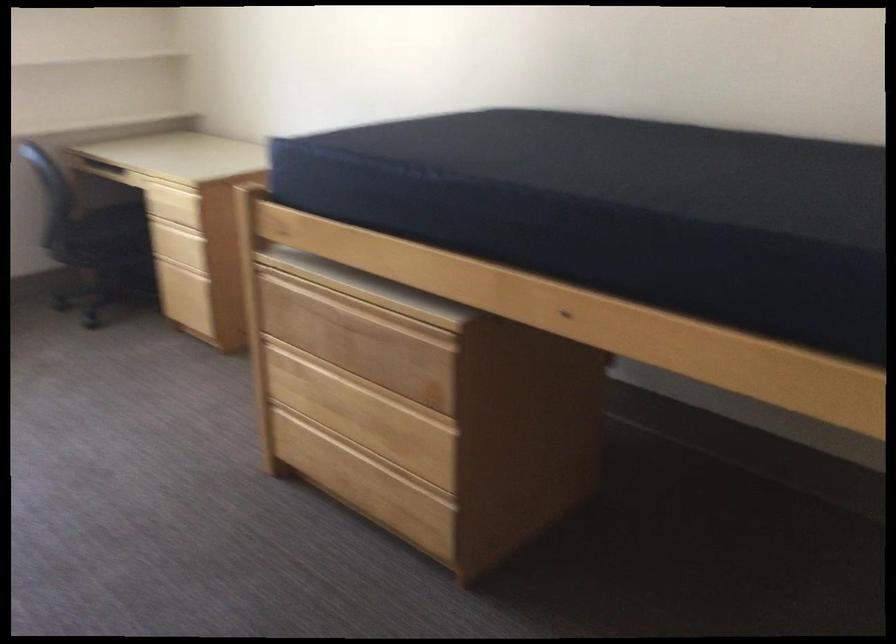
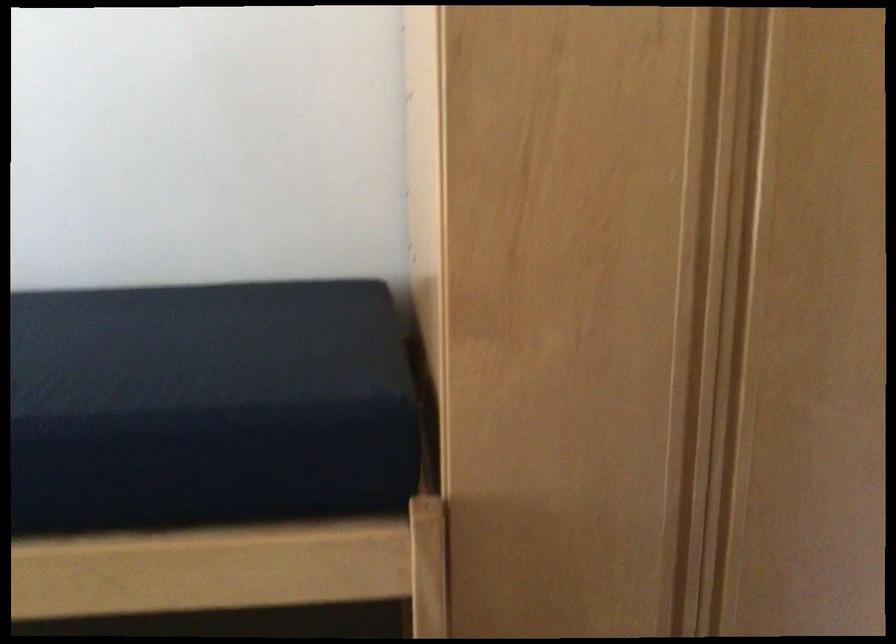
Question: The camera is either moving clockwise (left) or counter-clockwise (right) around the object. The first image is from the beginning of the video and the second image is from the end. Is the camera moving left or right when shooting the video?

Choices:
 (A) Left
 (B) Right

Answer: (A)